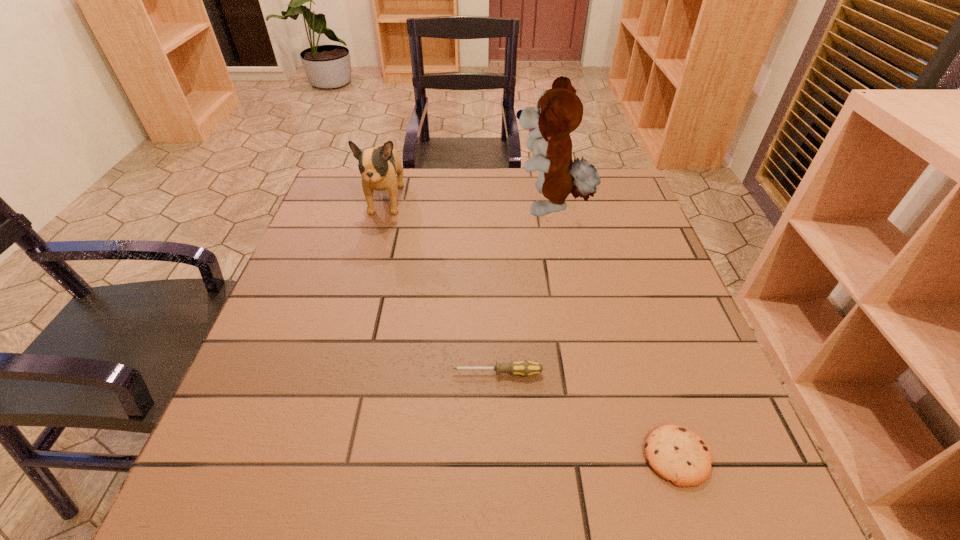
In order to click on vacant space situated 0.310m at the tip of the screwdriver in this screenshot , I will do `click(290, 373)`.

Locate an element on the screen. The height and width of the screenshot is (540, 960). vacant space located 0.060m at the tip of the screwdriver is located at coordinates (420, 373).

Locate an element on the screen. Image resolution: width=960 pixels, height=540 pixels. vacant position located at the tip of the screwdriver is located at coordinates (373, 373).

In order to click on blank space located on the back of the cookie in this screenshot , I will do `click(638, 340)`.

At what (x,y) coordinates should I click in order to perform the action: click on object positioned at the near edge. Please return your answer as a coordinate pair (x, y). The height and width of the screenshot is (540, 960). Looking at the image, I should click on (676, 454).

Identify the location of object that is at the left edge. The height and width of the screenshot is (540, 960). (378, 166).

This screenshot has width=960, height=540. In order to click on puppy positioned at the right edge in this screenshot , I will do `click(559, 111)`.

I want to click on cookie that is at the right edge, so click(676, 454).

Identify the location of object that is at the far left corner. The image size is (960, 540). (378, 166).

Image resolution: width=960 pixels, height=540 pixels. Identify the location of object present at the far right corner. (559, 111).